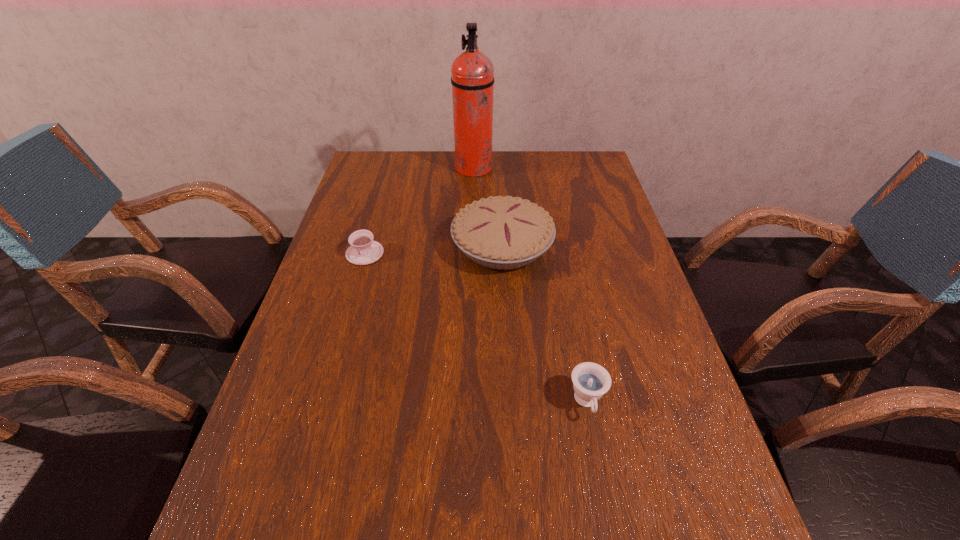
Identify the location of free space located on the handle side of the shorter teacup. (328, 382).

This screenshot has height=540, width=960. I want to click on object located at the far edge, so click(x=472, y=73).

Image resolution: width=960 pixels, height=540 pixels. I want to click on object at the left edge, so click(363, 250).

Image resolution: width=960 pixels, height=540 pixels. What are the coordinates of `free space at the far edge of the desktop` in the screenshot? It's located at (503, 168).

Find the location of a particular element. This screenshot has width=960, height=540. vacant space at the left edge is located at coordinates click(x=268, y=427).

Identify the location of vacant space at the right edge of the desktop. (615, 234).

Find the location of a particular element. The height and width of the screenshot is (540, 960). vacant region at the far right corner of the desktop is located at coordinates (589, 183).

Where is `vacant space in between the right teacup and the second tallest object`? This screenshot has height=540, width=960. vacant space in between the right teacup and the second tallest object is located at coordinates (544, 324).

Locate an element on the screen. This screenshot has height=540, width=960. vacant space that is in between the taller teacup and the third shortest object is located at coordinates (544, 324).

Identify the location of vacant area between the nearest object and the fire extinguisher. The image size is (960, 540). (530, 286).